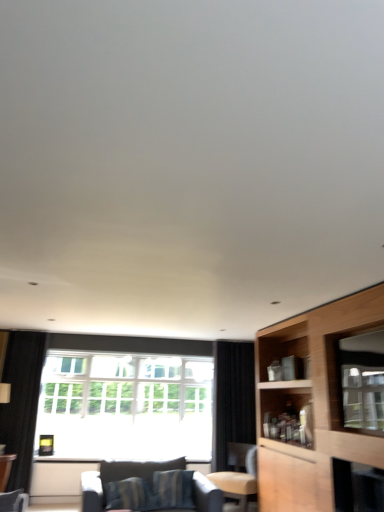
Question: Could you tell me if clear glass window at center is turned towards light brown leather chair at center?

Choices:
 (A) yes
 (B) no

Answer: (A)

Question: Is light brown leather chair at center inside clear glass window at center?

Choices:
 (A) no
 (B) yes

Answer: (A)

Question: Is clear glass window at center further to the viewer compared to light brown leather chair at center?

Choices:
 (A) no
 (B) yes

Answer: (B)

Question: Can you confirm if clear glass window at center is positioned to the right of light brown leather chair at center?

Choices:
 (A) yes
 (B) no

Answer: (B)

Question: Does clear glass window at center have a lesser width compared to light brown leather chair at center?

Choices:
 (A) yes
 (B) no

Answer: (A)

Question: From the image's perspective, is striped fabric couch at lower center located above or below clear glass window at center?

Choices:
 (A) above
 (B) below

Answer: (B)

Question: Is striped fabric couch at lower center wider or thinner than clear glass window at center?

Choices:
 (A) thin
 (B) wide

Answer: (B)

Question: Choose the correct answer: Is striped fabric couch at lower center inside clear glass window at center or outside it?

Choices:
 (A) inside
 (B) outside

Answer: (B)

Question: Visually, is striped fabric couch at lower center positioned to the left or to the right of clear glass window at center?

Choices:
 (A) right
 (B) left

Answer: (A)

Question: Is wooden table at lower left inside the boundaries of striped fabric couch at lower center, or outside?

Choices:
 (A) inside
 (B) outside

Answer: (B)

Question: Looking at their shapes, would you say wooden table at lower left is wider or thinner than striped fabric couch at lower center?

Choices:
 (A) wide
 (B) thin

Answer: (B)

Question: From a real-world perspective, relative to striped fabric couch at lower center, is wooden table at lower left vertically above or below?

Choices:
 (A) below
 (B) above

Answer: (A)

Question: Based on their sizes in the image, would you say wooden table at lower left is bigger or smaller than striped fabric couch at lower center?

Choices:
 (A) big
 (B) small

Answer: (B)

Question: Considering the positions of black fabric curtain at left, the 1th curtain viewed from the left, and light brown leather chair at center in the image, is black fabric curtain at left, the 1th curtain viewed from the left, bigger or smaller than light brown leather chair at center?

Choices:
 (A) big
 (B) small

Answer: (B)

Question: Looking at their shapes, would you say black fabric curtain at left, the 2th curtain from the right, is wider or thinner than light brown leather chair at center?

Choices:
 (A) thin
 (B) wide

Answer: (A)